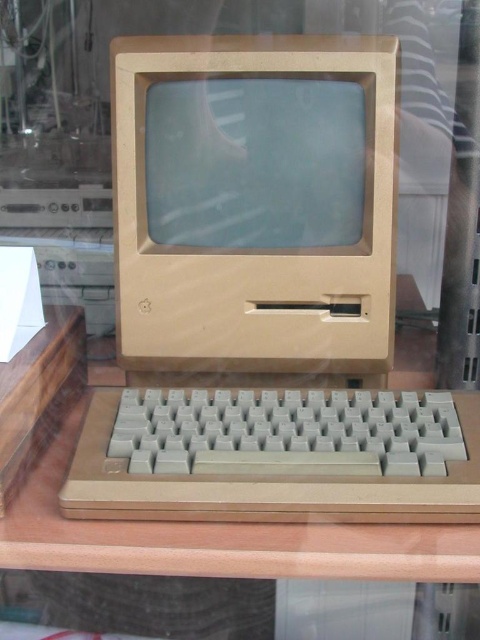
Between beige plastic desktop computer at center and gold metallic computer monitor at center, which one has less height?

gold metallic computer monitor at center is shorter.

Describe the element at coordinates (255, 205) in the screenshot. I see `beige plastic desktop computer at center` at that location.

This screenshot has height=640, width=480. In order to click on beige plastic desktop computer at center in this screenshot , I will do `click(255, 205)`.

Between gold metallic computer monitor at center and wooden table at center, which one is positioned higher?

Positioned higher is gold metallic computer monitor at center.

Is point (382, 84) more distant than point (16, 556)?

Yes, it is.

This screenshot has width=480, height=640. I want to click on gold metallic computer monitor at center, so click(254, 202).

Does beige plastic desktop computer at center have a larger size compared to wooden table at center?

No.

Is beige plastic desktop computer at center to the right of wooden table at center from the viewer's perspective?

Correct, you'll find beige plastic desktop computer at center to the right of wooden table at center.

Describe the element at coordinates (255, 205) in the screenshot. I see `beige plastic desktop computer at center` at that location.

This screenshot has width=480, height=640. I want to click on beige plastic desktop computer at center, so click(255, 205).